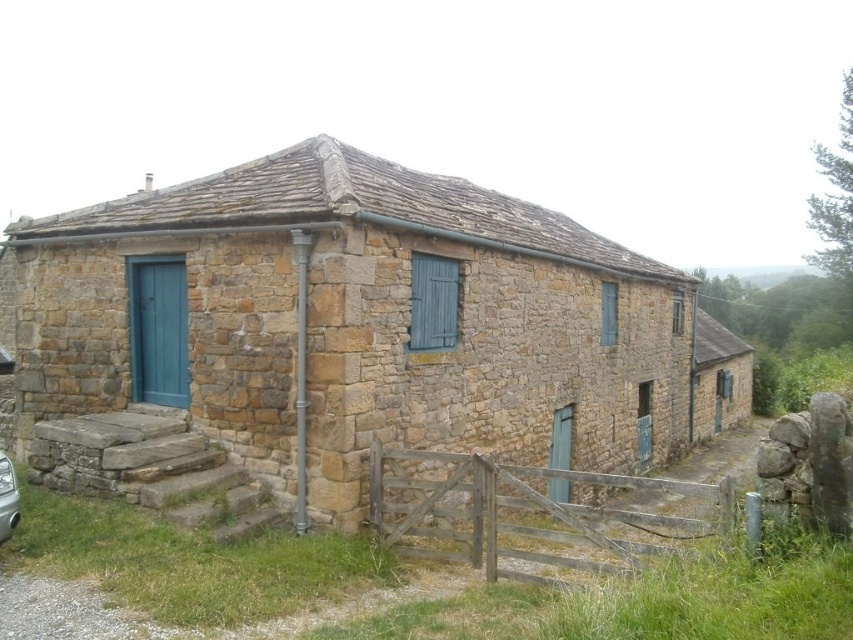
At what (x,y) coordinates should I click in order to perform the action: click on rustic stone cottage at center. Please return your answer as a coordinate pair (x, y). Looking at the image, I should click on (364, 323).

Is rustic stone cottage at center positioned at the back of silver metallic car at lower left?

That is True.

Between point (241, 168) and point (4, 524), which one is positioned behind?

Positioned behind is point (241, 168).

Locate an element on the screen. The width and height of the screenshot is (853, 640). rustic stone cottage at center is located at coordinates (364, 323).